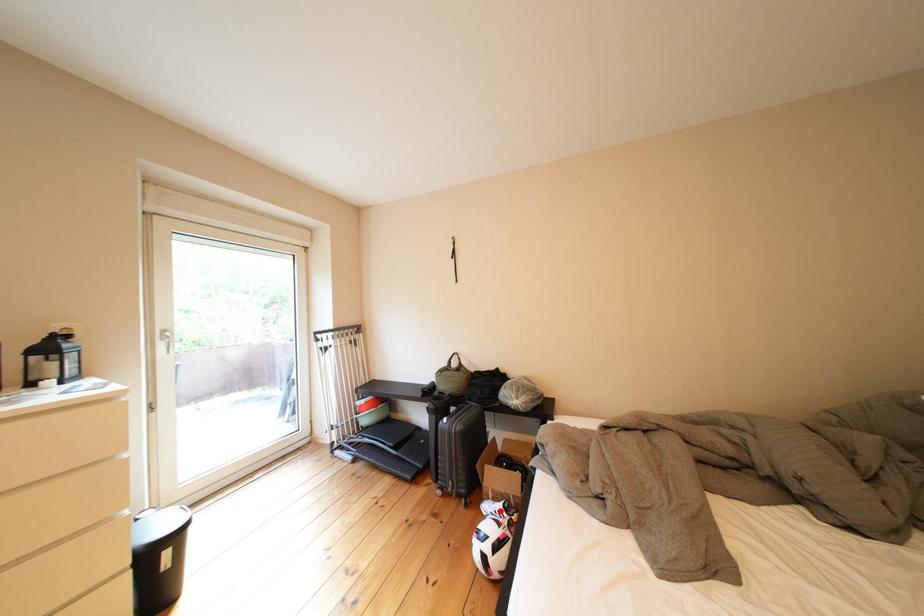
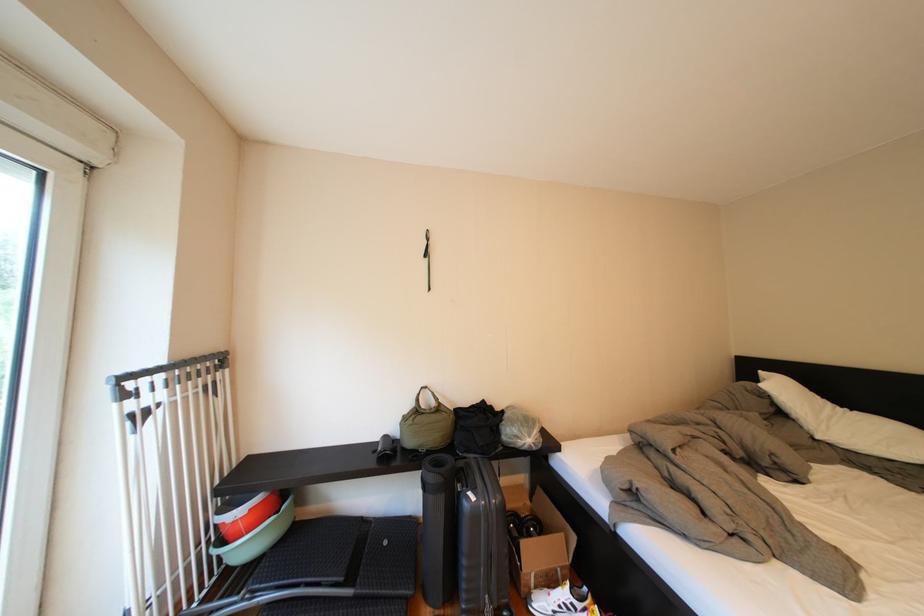
In the second image, find the point that corresponds to the highlighted location in the first image.

(554, 609)